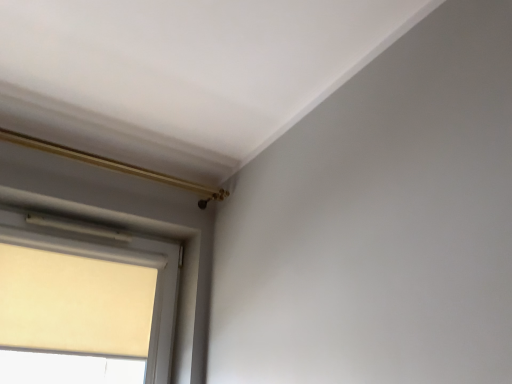
What is the approximate width of beige fabric window at lower left?

The width of beige fabric window at lower left is 3.02 inches.

The height and width of the screenshot is (384, 512). Find the location of `beige fabric window at lower left`. beige fabric window at lower left is located at coordinates (76, 298).

Describe the element at coordinates (76, 298) in the screenshot. I see `beige fabric window at lower left` at that location.

You are a GUI agent. You are given a task and a screenshot of the screen. Output one action in this format:
    pyautogui.click(x=<x>, y=<y>)
    Task: Click on the beige fabric window at lower left
    The image size is (512, 384).
    Given the screenshot: What is the action you would take?
    pyautogui.click(x=76, y=298)